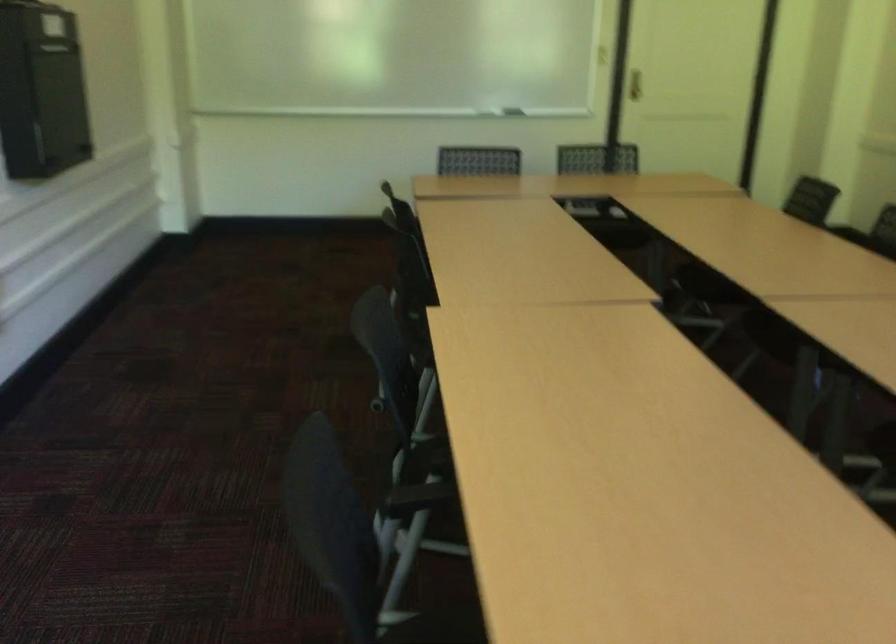
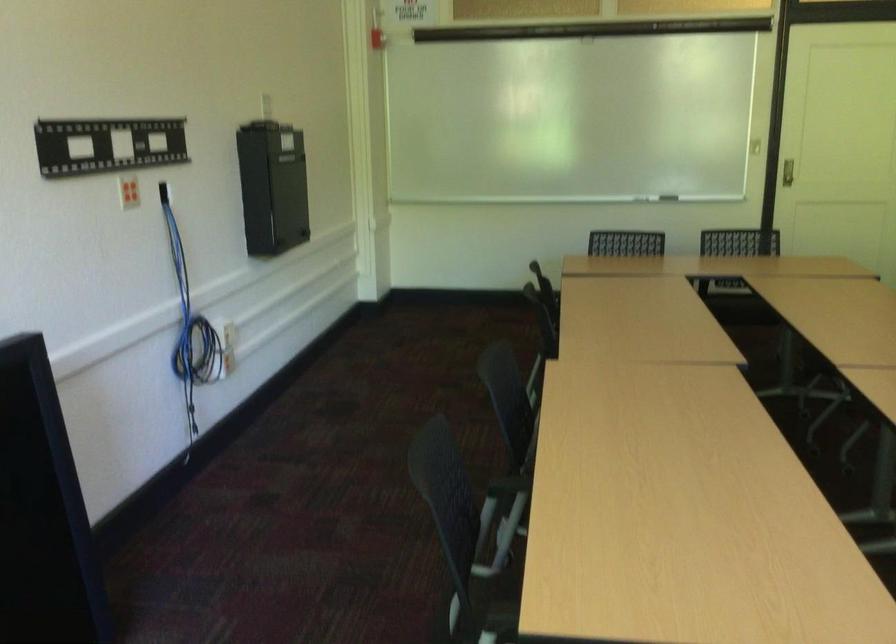
Question: The camera is either moving clockwise (left) or counter-clockwise (right) around the object. The first image is from the beginning of the video and the second image is from the end. Is the camera moving left or right when shooting the video?

Choices:
 (A) Left
 (B) Right

Answer: (B)